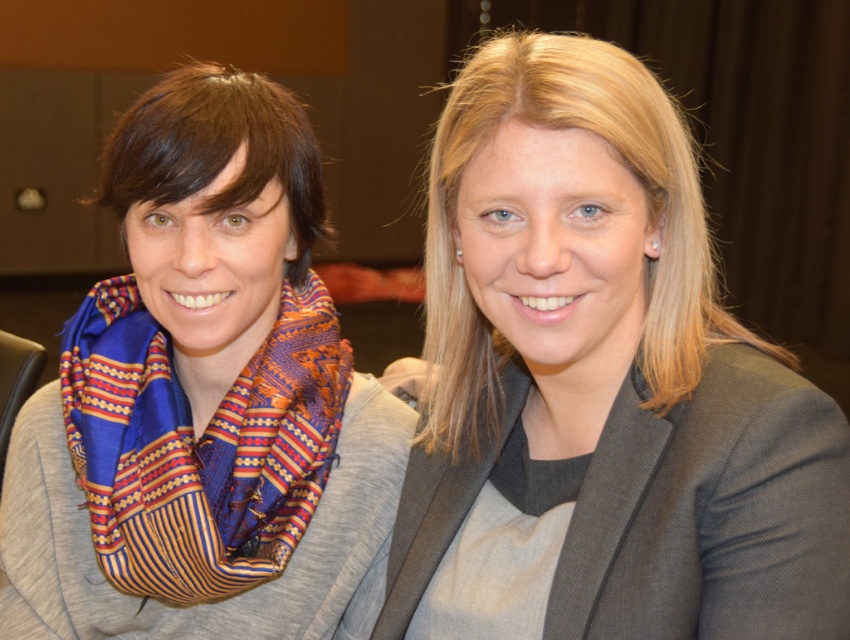
Does smooth gray blazer at center come behind silky blue and orange scarf at left?

No, smooth gray blazer at center is in front of silky blue and orange scarf at left.

Identify the location of smooth gray blazer at center. The width and height of the screenshot is (850, 640). (604, 378).

You are a GUI agent. You are given a task and a screenshot of the screen. Output one action in this format:
    pyautogui.click(x=<x>, y=<y>)
    Task: Click on the smooth gray blazer at center
    
    Given the screenshot: What is the action you would take?
    pyautogui.click(x=604, y=378)

Where is `smooth gray blazer at center`? The height and width of the screenshot is (640, 850). smooth gray blazer at center is located at coordinates (604, 378).

Is matte blue scarf at left wider than silky blue and orange scarf at left?

Yes.

Is matte blue scarf at left above silky blue and orange scarf at left?

Yes.

Where is `matte blue scarf at left`? matte blue scarf at left is located at coordinates pyautogui.click(x=204, y=401).

Can you confirm if smooth gray blazer at center is positioned above matte blue scarf at left?

Indeed, smooth gray blazer at center is positioned over matte blue scarf at left.

Can you confirm if smooth gray blazer at center is thinner than matte blue scarf at left?

Indeed, smooth gray blazer at center has a lesser width compared to matte blue scarf at left.

This screenshot has height=640, width=850. Identify the location of smooth gray blazer at center. (604, 378).